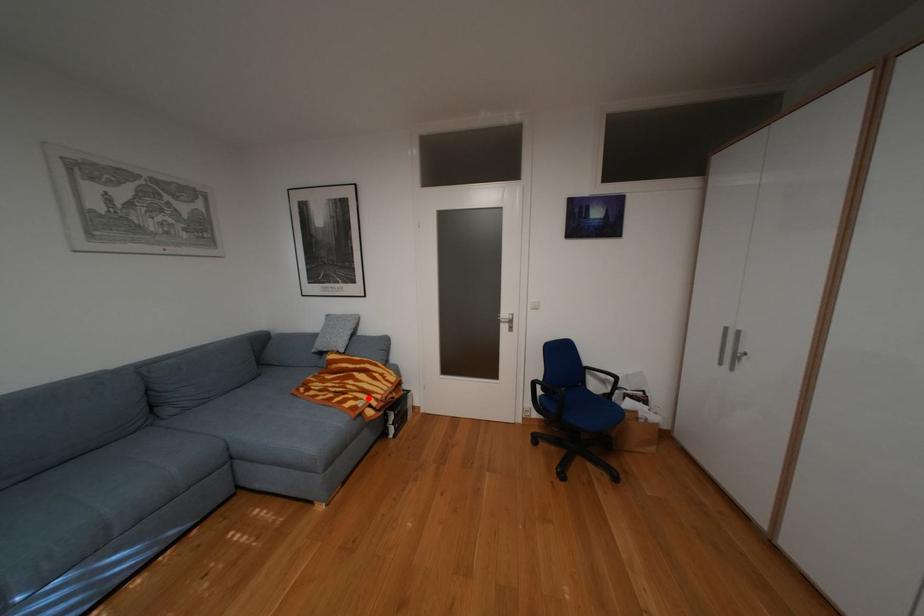
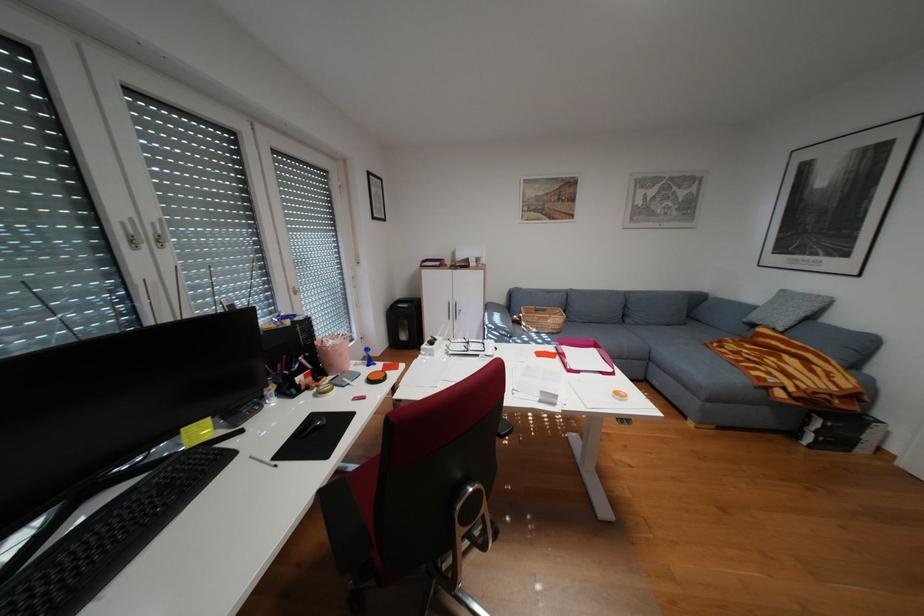
Locate, in the second image, the point that corresponds to the highlighted location in the first image.

(782, 373)